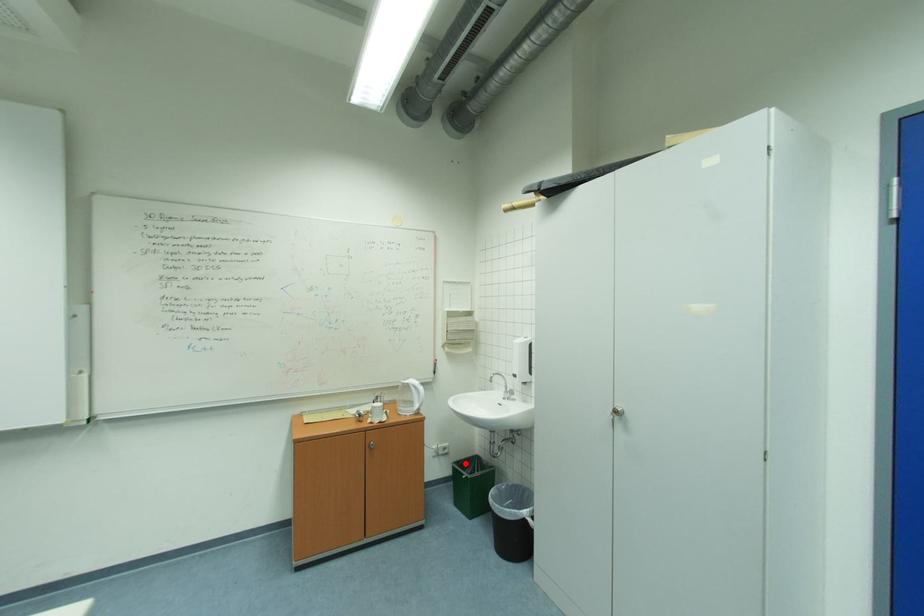
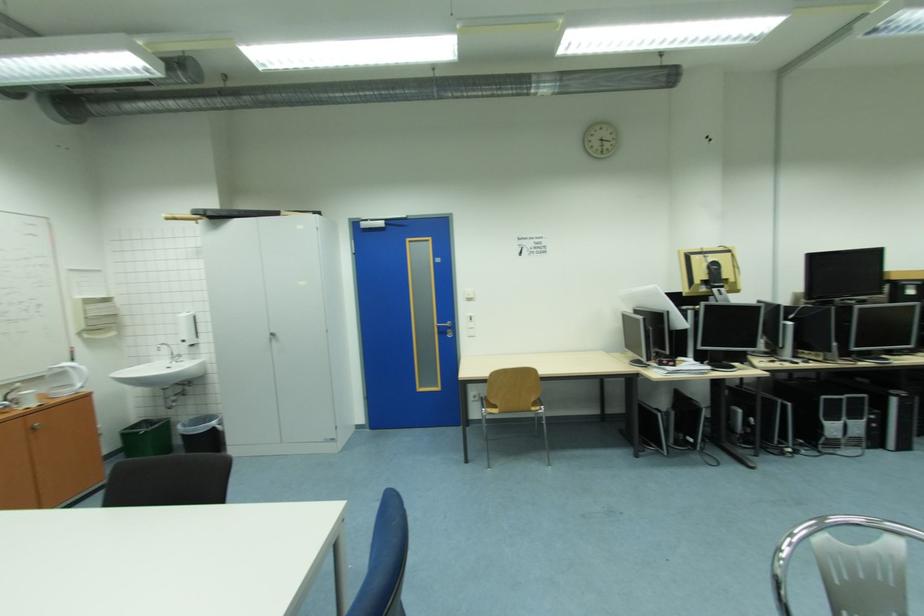
Where in the second image is the point corresponding to the highlighted location from the first image?

(130, 431)